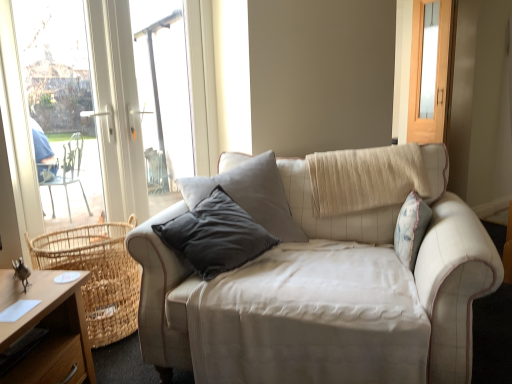
Question: Is beige fabric couch at center wider or thinner than wooden desk at lower left?

Choices:
 (A) thin
 (B) wide

Answer: (B)

Question: Considering the positions of beige fabric couch at center and wooden desk at lower left in the image, is beige fabric couch at center taller or shorter than wooden desk at lower left?

Choices:
 (A) short
 (B) tall

Answer: (B)

Question: Based on their relative distances, which object is nearer to the beige fabric couch at center?

Choices:
 (A) wooden desk at lower left
 (B) woven natural basket at lower left
 (C) matte wooden screen door at upper right

Answer: (B)

Question: Estimate the real-world distances between objects in this image. Which object is farther from the matte wooden screen door at upper right?

Choices:
 (A) wooden desk at lower left
 (B) woven natural basket at lower left
 (C) beige fabric couch at center

Answer: (A)